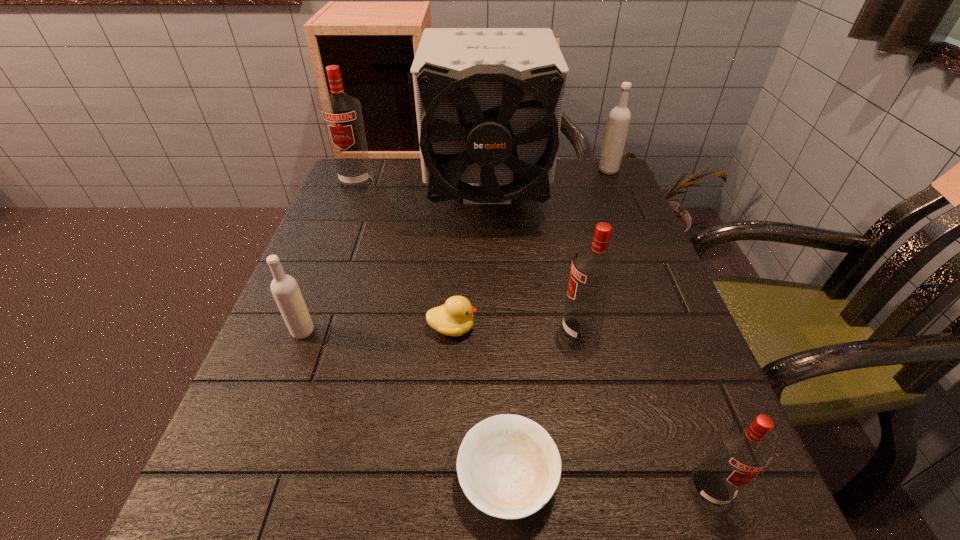
Where is `gray fan`? The image size is (960, 540). gray fan is located at coordinates (489, 101).

Locate an element on the screen. the tallest object is located at coordinates (489, 101).

Locate an element on the screen. the second tallest object is located at coordinates (342, 114).

Locate an element on the screen. This screenshot has width=960, height=540. the farthest red vodka is located at coordinates (342, 114).

Where is `the farther white vodka`? The width and height of the screenshot is (960, 540). the farther white vodka is located at coordinates (619, 118).

Find the location of a particular element. the bigger white vodka is located at coordinates (619, 118).

Where is `the second smallest red vodka`? This screenshot has width=960, height=540. the second smallest red vodka is located at coordinates (594, 270).

You are a GUI agent. You are given a task and a screenshot of the screen. Output one action in this format:
    pyautogui.click(x=<x>, y=<y>)
    Task: Click on the third vodka from right to left
    The width and height of the screenshot is (960, 540).
    Given the screenshot: What is the action you would take?
    pyautogui.click(x=594, y=270)

This screenshot has height=540, width=960. I want to click on the left white vodka, so pos(285,290).

You are a GUI agent. You are given a task and a screenshot of the screen. Output one action in this format:
    pyautogui.click(x=<x>, y=<y>)
    Task: Click on the nearer white vodka
    
    Given the screenshot: What is the action you would take?
    pyautogui.click(x=285, y=290)